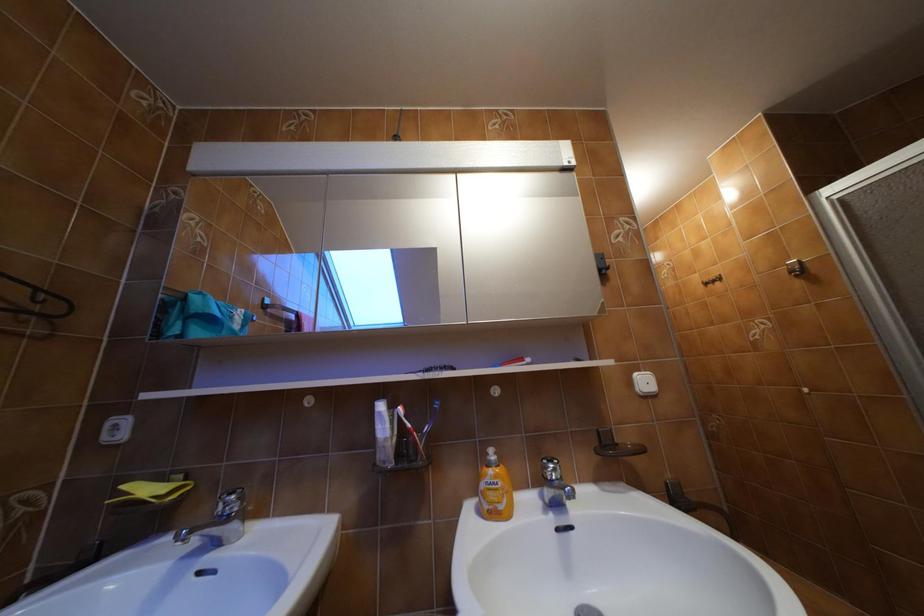
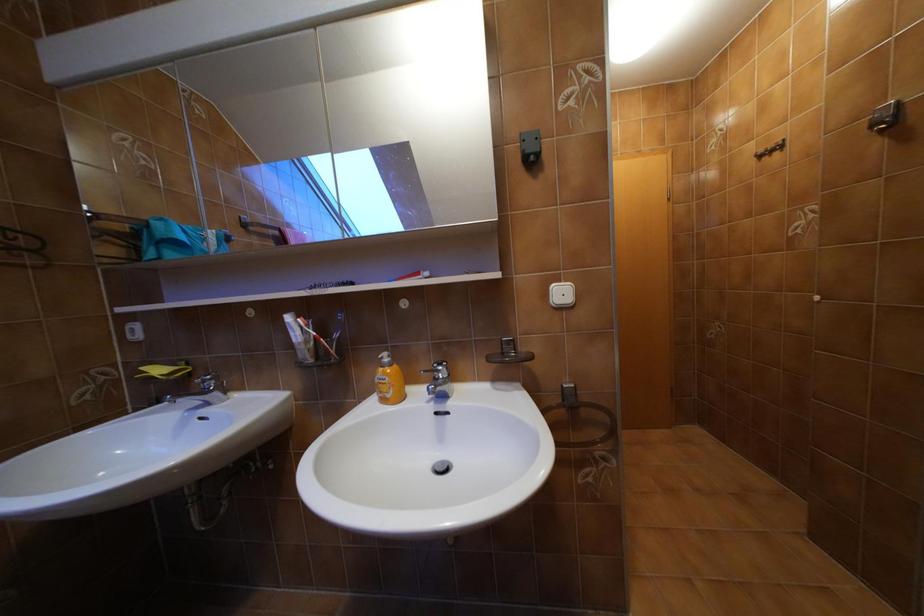
Question: The images are taken continuously from a first-person perspective. In which direction are you moving?

Choices:
 (A) Left
 (B) Right
 (C) Forward
 (D) Backward

Answer: (B)